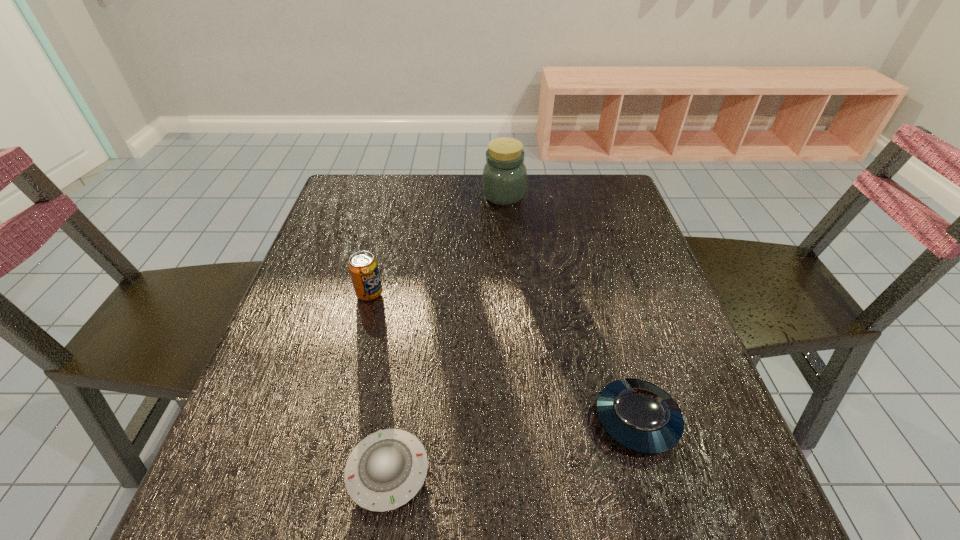
The height and width of the screenshot is (540, 960). In the image, there is a desktop. Identify the location of vacant region at the far left corner. click(357, 202).

Where is `free spot between the rightmost object and the third nearest object`? This screenshot has height=540, width=960. free spot between the rightmost object and the third nearest object is located at coordinates (503, 356).

Find the location of `free space between the tallest object and the soda can`. free space between the tallest object and the soda can is located at coordinates (437, 244).

Identify the location of vacant area between the soda can and the jar. (437, 244).

Image resolution: width=960 pixels, height=540 pixels. Identify the location of empty space that is in between the leftmost object and the jar. pyautogui.click(x=437, y=244).

This screenshot has height=540, width=960. Identify the location of empty location between the left saucer and the soda can. (378, 382).

Find the location of a particular element. This screenshot has height=540, width=960. vacant space that is in between the rightmost object and the left saucer is located at coordinates (513, 446).

Find the location of a particular element. Image resolution: width=960 pixels, height=540 pixels. free space that is in between the right saucer and the left saucer is located at coordinates (513, 446).

Where is `free space that is in between the leftmost object and the left saucer`? Image resolution: width=960 pixels, height=540 pixels. free space that is in between the leftmost object and the left saucer is located at coordinates (378, 382).

Find the location of `vacant area that lies between the tallest object and the right saucer`. vacant area that lies between the tallest object and the right saucer is located at coordinates (570, 308).